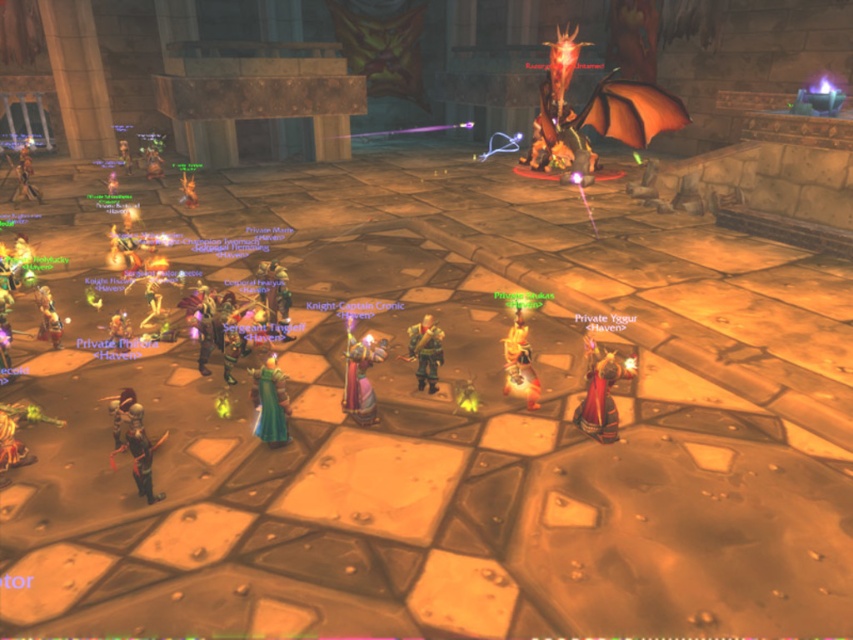
You are a character in the game and need to pick up the leather armor at lower left. What are the coordinates where you should move to?

The coordinates for the leather armor at lower left are at point (138,451).

In the ancient stone hall, there are two central figures wearing a shiny purple robe at center and smooth leather armor at center. From the perspective of someone standing at the entrance facing the hall, which one is positioned to the right?

The shiny purple robe at center is positioned to the right of the smooth leather armor at center.

You are a player in a fantasy game and need to locate the shiny purple robe at center. According to the map coordinates, where should you look to find it?

The shiny purple robe at center is located at coordinates point (360, 378).